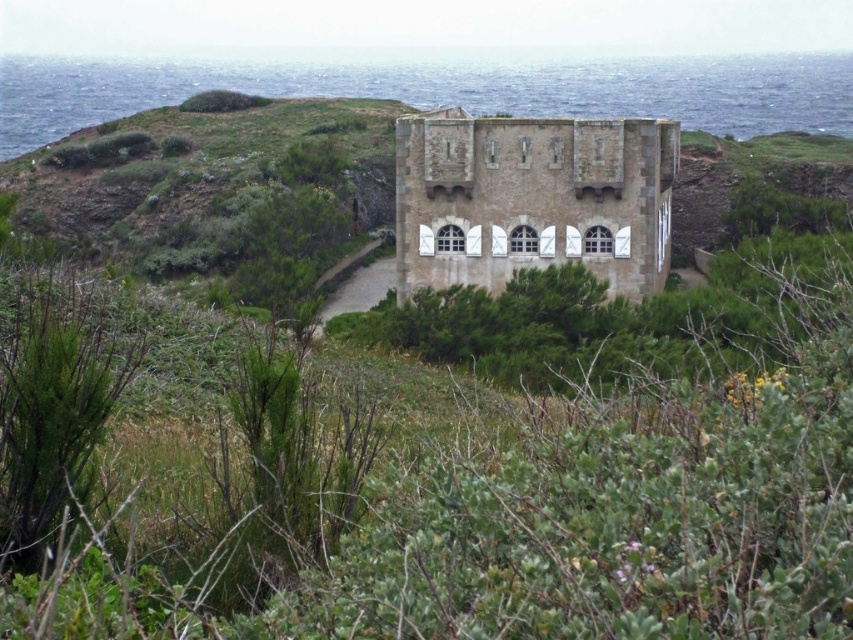
You are standing at the point marked as point (444,88) in the image. What do you see directly in front of you?

You are standing at point (444,88), which corresponds to blue water at center. Therefore, directly in front of you is blue water at center.